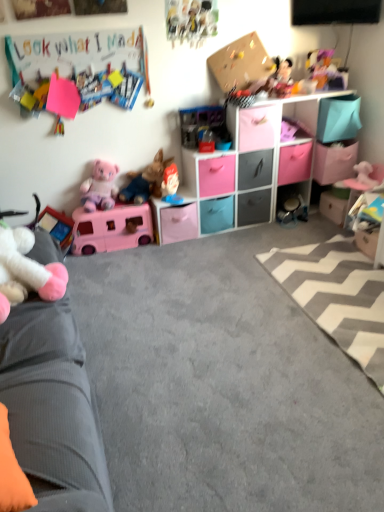
Identify the location of unoccupied area in front of pink plastic drawer at center, which appears as the first drawer when viewed from the left. The width and height of the screenshot is (384, 512). (175, 258).